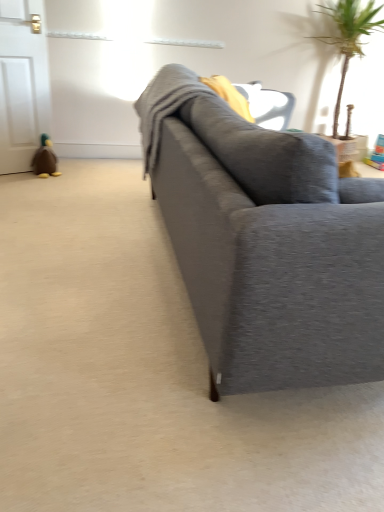
Image resolution: width=384 pixels, height=512 pixels. In order to click on free space to the back side of brown plush duck at left in this screenshot , I will do `click(65, 169)`.